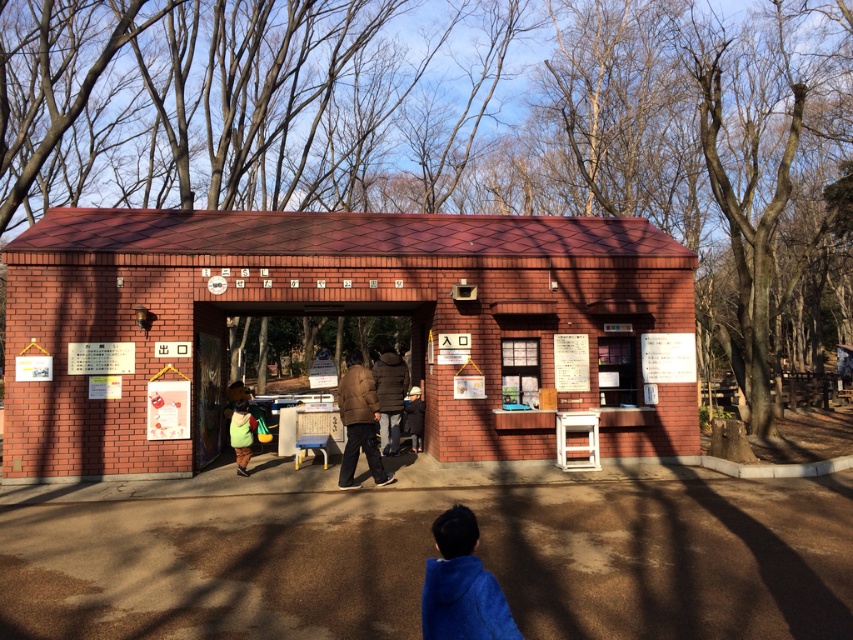
Consider the image. You are standing in front of the red brick hut at center and want to hang a small sign above the entrance. The sign is 1.2 meters tall. Considering the height of the brown fuzzy coat at center, can you safely place the sign without it being obscured?

The red brick hut at center is taller than the brown fuzzy coat at center. Since the sign is 1.2 meters tall, and the brown fuzzy coat at center is shorter, the sign can be placed above the entrance without being obscured by the brown fuzzy coat at center.

From the picture: You are standing outside the brick building and notice a blue fleece jacket at lower center and a green fabric backpack at center. Which object is closer to you?

The blue fleece jacket at lower center is closer to you because it is in front of the green fabric backpack at center.